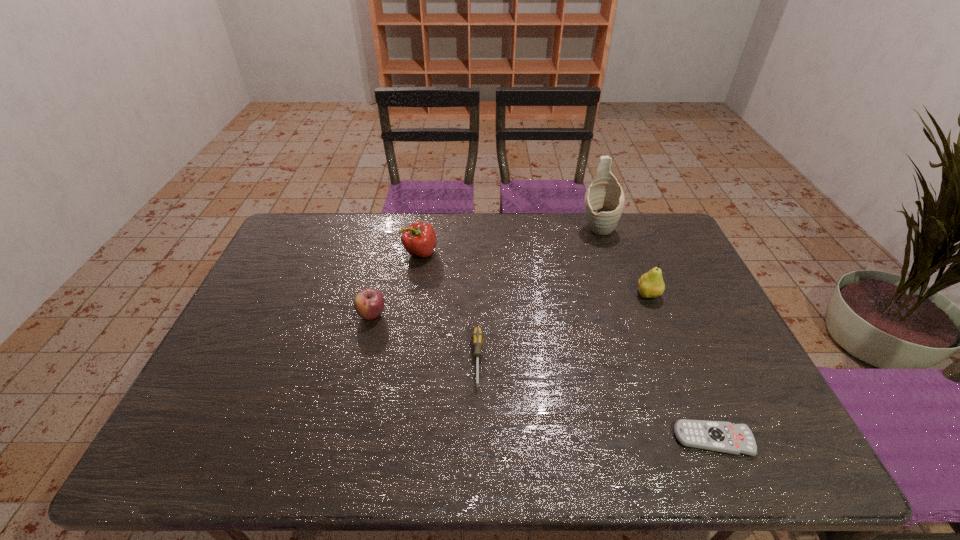
Locate which object ranks in proximity to the nearest object. Please provide its 2D coordinates. Your answer should be formatted as a tuple, i.e. [(x, y)], where the tuple contains the x and y coordinates of a point satisfying the conditions above.

[(651, 284)]

Where is `vacant space that satisfies the following two spatial constraints: 1. on the front side of the fifth object from right to left; 2. on the right side of the nearest object`? vacant space that satisfies the following two spatial constraints: 1. on the front side of the fifth object from right to left; 2. on the right side of the nearest object is located at coordinates (391, 440).

The image size is (960, 540). Find the location of `free region that satisfies the following two spatial constraints: 1. at the spout of the farthest object; 2. on the right side of the nearest object`. free region that satisfies the following two spatial constraints: 1. at the spout of the farthest object; 2. on the right side of the nearest object is located at coordinates (668, 440).

I want to click on blank space that satisfies the following two spatial constraints: 1. at the spout of the shortest object; 2. on the left side of the pitcher, so click(668, 440).

This screenshot has height=540, width=960. Identify the location of vacant space that satisfies the following two spatial constraints: 1. at the tip of the remote control; 2. on the right side of the fourth object from right to left. (477, 440).